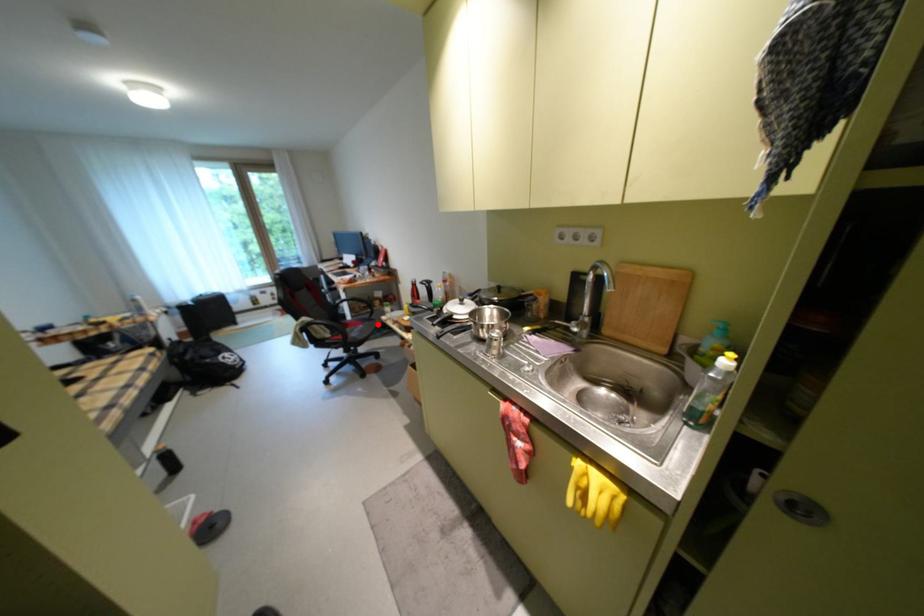
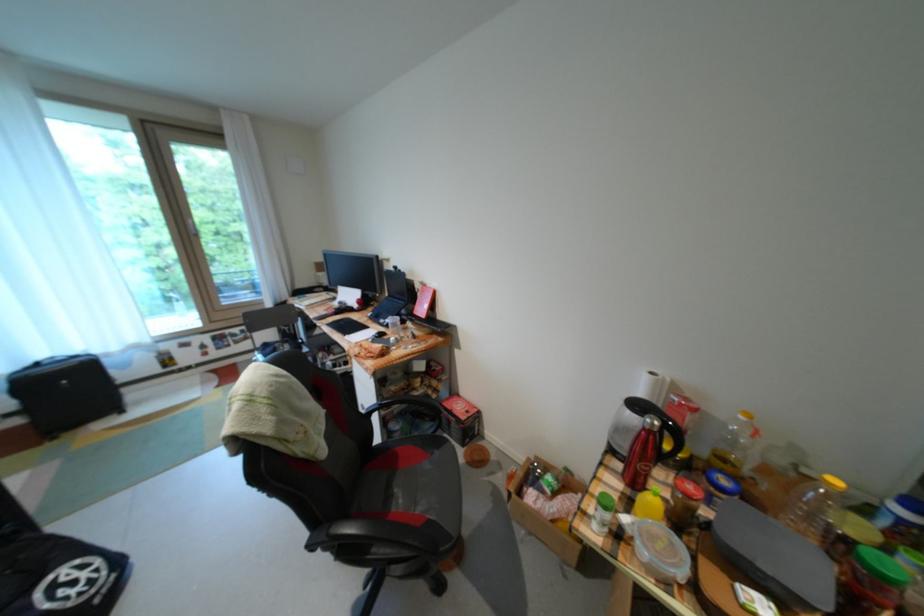
Question: I am providing you with two images of the same scene from different viewpoints. Given a red point in image1, look at the same physical point in image2. Is it:

Choices:
 (A) Closer to the viewpoint
 (B) Farther from the viewpoint

Answer: (A)